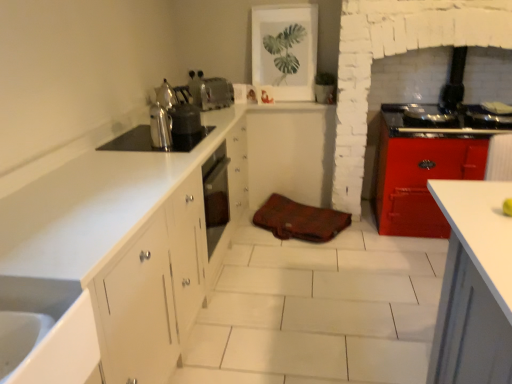
Question: From the image's perspective, is shiny metallic tea pot at upper left on top of white matte cabinet at center?

Choices:
 (A) no
 (B) yes

Answer: (B)

Question: Does shiny metallic tea pot at upper left lie in front of white matte cabinet at center?

Choices:
 (A) no
 (B) yes

Answer: (B)

Question: Does shiny metallic tea pot at upper left have a greater width compared to white matte cabinet at center?

Choices:
 (A) yes
 (B) no

Answer: (B)

Question: Is shiny metallic tea pot at upper left not near white matte cabinet at center?

Choices:
 (A) yes
 (B) no

Answer: (A)

Question: Is shiny metallic tea pot at upper left surrounding white matte cabinet at center?

Choices:
 (A) yes
 (B) no

Answer: (B)

Question: Is satin silver toaster at upper center, the 1th appliance positioned from the back, in front of or behind shiny metallic kettle at center-left in the image?

Choices:
 (A) behind
 (B) front

Answer: (A)

Question: Is satin silver toaster at upper center, the 3th appliance from the front, taller or shorter than shiny metallic kettle at center-left?

Choices:
 (A) short
 (B) tall

Answer: (A)

Question: From a real-world perspective, is satin silver toaster at upper center, the 3th appliance from the front, above or below shiny metallic kettle at center-left?

Choices:
 (A) below
 (B) above

Answer: (A)

Question: Does point (208, 82) appear closer or farther from the camera than point (167, 100)?

Choices:
 (A) farther
 (B) closer

Answer: (A)

Question: Based on their positions, is satin silver toaster at upper center, the 1th appliance positioned from the back, located to the left or right of brown leather bag at center?

Choices:
 (A) left
 (B) right

Answer: (A)

Question: From the image's perspective, is satin silver toaster at upper center, the 1th appliance positioned from the back, located above or below brown leather bag at center?

Choices:
 (A) above
 (B) below

Answer: (A)

Question: Considering the positions of point (220, 77) and point (297, 210), is point (220, 77) closer or farther from the camera than point (297, 210)?

Choices:
 (A) closer
 (B) farther

Answer: (B)

Question: Is satin silver toaster at upper center, the 1th appliance positioned from the back, wider or thinner than brown leather bag at center?

Choices:
 (A) thin
 (B) wide

Answer: (A)

Question: Choose the correct answer: Is satin silver kettle at upper left, acting as the second appliance starting from the back, inside satin silver kettle at upper left, the third appliance in the back-to-front sequence, or outside it?

Choices:
 (A) outside
 (B) inside

Answer: (A)

Question: In the image, is satin silver kettle at upper left, acting as the second appliance starting from the front, on the left side or the right side of satin silver kettle at upper left, the 1th appliance in the front-to-back sequence?

Choices:
 (A) left
 (B) right

Answer: (B)